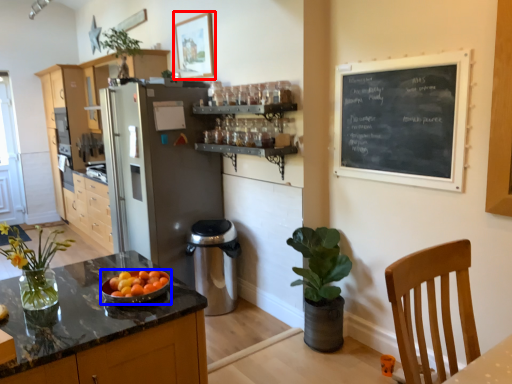
Question: Which object appears closest to the camera in this image, picture frame (highlighted by a red box) or kitchen appliance (highlighted by a blue box)?

Choices:
 (A) picture frame
 (B) kitchen appliance

Answer: (B)